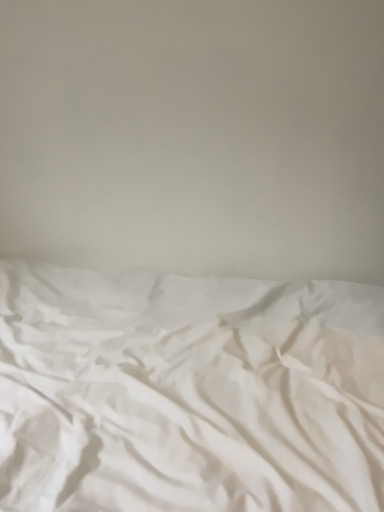
The width and height of the screenshot is (384, 512). What do you see at coordinates (195, 136) in the screenshot? I see `white fabric at lower center` at bounding box center [195, 136].

This screenshot has width=384, height=512. I want to click on white fabric at lower center, so click(x=195, y=136).

Image resolution: width=384 pixels, height=512 pixels. I want to click on white fabric at lower center, so click(195, 136).